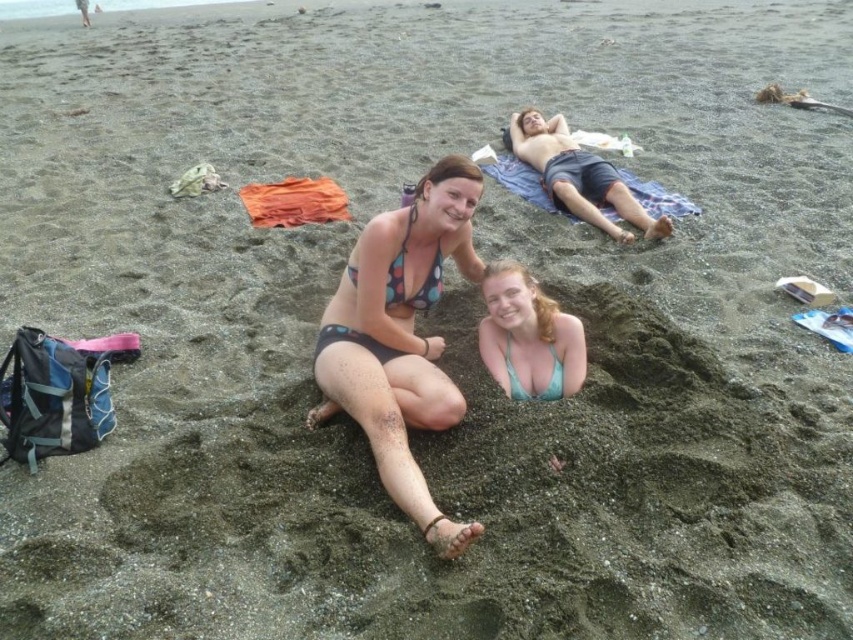
Is point (468, 259) farther from viewer compared to point (515, 300)?

Yes, point (468, 259) is farther from viewer.

You are a GUI agent. You are given a task and a screenshot of the screen. Output one action in this format:
    pyautogui.click(x=<x>, y=<y>)
    Task: Click on the polka dot bikini bottom at center
    This screenshot has height=640, width=853.
    Given the screenshot: What is the action you would take?
    point(399,337)

Between point (369, 381) and point (579, 380), which one is positioned behind?

Positioned behind is point (579, 380).

The image size is (853, 640). I want to click on polka dot bikini bottom at center, so click(399, 337).